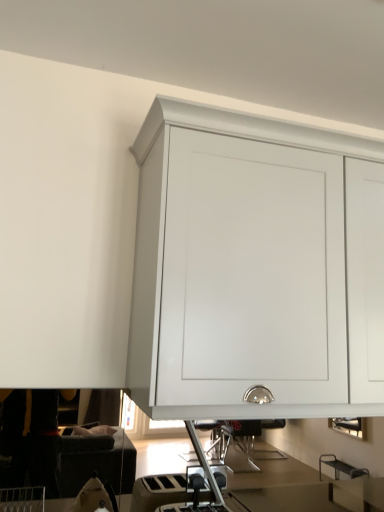
Question: Should I look upward or downward to see white matte cabinet at upper center?

Choices:
 (A) down
 (B) up

Answer: (A)